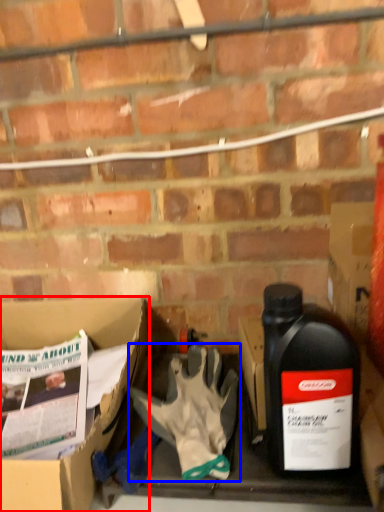
Question: Which object is closer to the camera taking this photo, box (highlighted by a red box) or glove (highlighted by a blue box)?

Choices:
 (A) box
 (B) glove

Answer: (A)